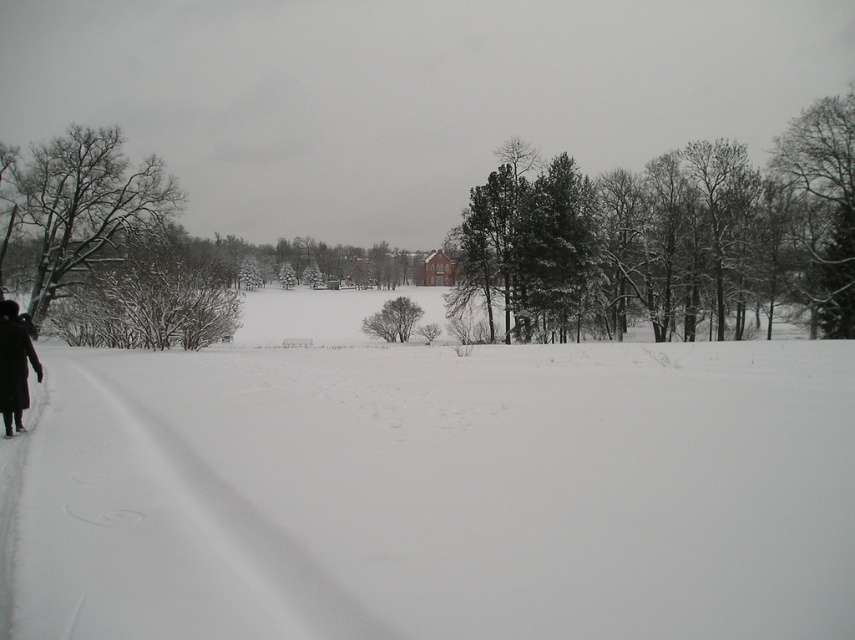
Question: Which point appears farthest from the camera in this image?

Choices:
 (A) (140, 209)
 (B) (36, 365)
 (C) (838, 304)
 (D) (210, 502)

Answer: (A)

Question: Is white snow at left positioned at the back of snow-covered evergreen tree at upper right?

Choices:
 (A) no
 (B) yes

Answer: (A)

Question: Which of the following is the closest to the observer?

Choices:
 (A) snow-covered pine trees at upper right
 (B) snow-covered branches at left
 (C) white fluffy snow at left
 (D) snow-covered evergreen tree at upper right

Answer: (C)

Question: Which of the following is the farthest from the observer?

Choices:
 (A) snow-covered branches at left
 (B) white snow at left

Answer: (A)

Question: Can you confirm if snow-covered pine trees at upper right is positioned to the right of snow-covered branches at left?

Choices:
 (A) yes
 (B) no

Answer: (A)

Question: Can you confirm if white snow at left is positioned above black matte coat at left?

Choices:
 (A) no
 (B) yes

Answer: (A)